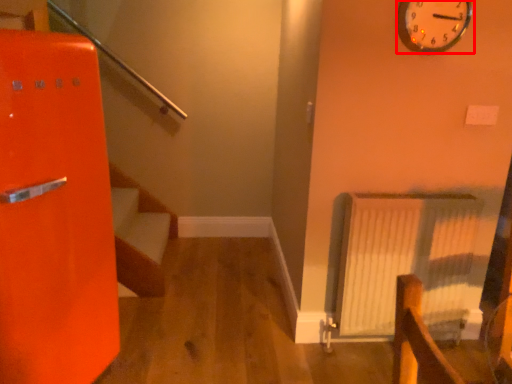
Question: From the image's perspective, what is the correct spatial positioning of wall clock (annotated by the red box) in reference to radiator?

Choices:
 (A) above
 (B) below

Answer: (A)